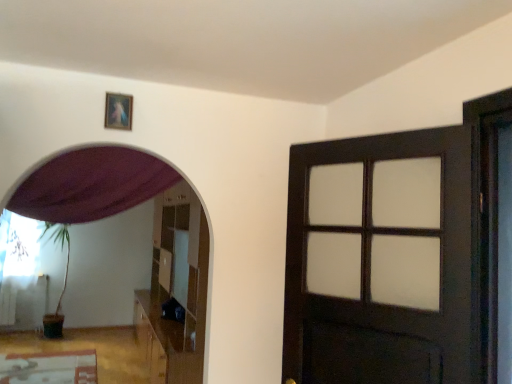
What do you see at coordinates (175, 289) in the screenshot? This screenshot has height=384, width=512. I see `glossy wooden dresser at center` at bounding box center [175, 289].

In order to face white sheer curtain at left, which is counted as the second curtain, starting from the top, should I rotate leftwards or rightwards?

Rotate your view left by about 28.781°.

Where is `wooden picture frame at upper center`? This screenshot has height=384, width=512. wooden picture frame at upper center is located at coordinates (118, 111).

Is dark wood door at right at the left side of purple fabric curtain at upper left, which is the first curtain in front-to-back order?

Incorrect, dark wood door at right is not on the left side of purple fabric curtain at upper left, which is the first curtain in front-to-back order.

From a real-world perspective, relative to purple fabric curtain at upper left, the 1th curtain positioned from the top, is dark wood door at right vertically above or below?

dark wood door at right is below purple fabric curtain at upper left, the 1th curtain positioned from the top.

Which of these two, dark wood door at right or purple fabric curtain at upper left, the 1th curtain positioned from the top, is bigger?

purple fabric curtain at upper left, the 1th curtain positioned from the top, is bigger.

Looking at this image, between glossy wooden dresser at center and white sheer curtain at left, the first curtain when ordered from left to right, which one has less height?

With less height is white sheer curtain at left, the first curtain when ordered from left to right.

The image size is (512, 384). What are the coordinates of `dresser above the white sheer curtain at left, positioned as the first curtain in back-to-front order (from the image's perspective)` in the screenshot? It's located at (175, 289).

From the image's perspective, is glossy wooden dresser at center over white sheer curtain at left, positioned as the first curtain in back-to-front order?

Yes, from the image's perspective, glossy wooden dresser at center is over white sheer curtain at left, positioned as the first curtain in back-to-front order.

Based on the photo, considering the sizes of objects glossy wooden dresser at center and white sheer curtain at left, positioned as the first curtain in back-to-front order, in the image provided, who is wider, glossy wooden dresser at center or white sheer curtain at left, positioned as the first curtain in back-to-front order,?

With larger width is glossy wooden dresser at center.

Is glossy wooden dresser at center oriented towards wooden picture frame at upper center?

No, glossy wooden dresser at center is not facing towards wooden picture frame at upper center.

Does glossy wooden dresser at center contain wooden picture frame at upper center?

Actually, wooden picture frame at upper center is outside glossy wooden dresser at center.

Is glossy wooden dresser at center taller or shorter than wooden picture frame at upper center?

glossy wooden dresser at center is taller than wooden picture frame at upper center.

From a real-world perspective, is glossy wooden dresser at center located higher than wooden picture frame at upper center?

Actually, glossy wooden dresser at center is physically below wooden picture frame at upper center in the real world.

Is white sheer curtain at left, marked as the second curtain in a front-to-back arrangement, spatially inside wooden picture frame at upper center, or outside of it?

white sheer curtain at left, marked as the second curtain in a front-to-back arrangement, lies outside wooden picture frame at upper center.

Where is `the 2nd curtain below the wooden picture frame at upper center (from the image's perspective)`? Image resolution: width=512 pixels, height=384 pixels. the 2nd curtain below the wooden picture frame at upper center (from the image's perspective) is located at coordinates (17, 245).

Is white sheer curtain at left, which is counted as the second curtain, starting from the right, placed right next to wooden picture frame at upper center?

No, white sheer curtain at left, which is counted as the second curtain, starting from the right, is not beside wooden picture frame at upper center.

What's the angular difference between dark wood door at right and wooden picture frame at upper center's facing directions?

There is a 57.9-degree angle between the facing directions of dark wood door at right and wooden picture frame at upper center.

Is dark wood door at right to the right of wooden picture frame at upper center from the viewer's perspective?

Indeed, dark wood door at right is positioned on the right side of wooden picture frame at upper center.

Could you tell me if dark wood door at right is facing wooden picture frame at upper center?

No.

Considering the sizes of dark wood door at right and wooden picture frame at upper center in the image, is dark wood door at right bigger or smaller than wooden picture frame at upper center?

dark wood door at right is bigger than wooden picture frame at upper center.

Does wooden picture frame at upper center have a greater height compared to dark wood door at right?

Incorrect, the height of wooden picture frame at upper center is not larger of that of dark wood door at right.

Considering the positions of points (124, 104) and (423, 151), is point (124, 104) farther from camera compared to point (423, 151)?

Yes, it is behind point (423, 151).

In the image, is wooden picture frame at upper center positioned in front of or behind dark wood door at right?

wooden picture frame at upper center is behind dark wood door at right.

Is wooden picture frame at upper center aimed at dark wood door at right?

No.

Does glossy wooden dresser at center have a larger size compared to dark wood door at right?

Yes.

Locate an element on the screen. dresser behind the dark wood door at right is located at coordinates (175, 289).

Looking at this image, is glossy wooden dresser at center touching dark wood door at right?

glossy wooden dresser at center and dark wood door at right are not in contact.

Considering the relative sizes of glossy wooden dresser at center and dark wood door at right in the image provided, is glossy wooden dresser at center shorter than dark wood door at right?

No, glossy wooden dresser at center is not shorter than dark wood door at right.

Identify the location of door on the right of purple fabric curtain at upper left, which ranks as the 1th curtain in right-to-left order. (380, 260).

Locate an element on the screen. The image size is (512, 384). curtain located underneath the glossy wooden dresser at center (from a real-world perspective) is located at coordinates (17, 245).

Consider the image. Estimate the real-world distances between objects in this image. Which object is further from white sheer curtain at left, positioned as the first curtain in back-to-front order, purple fabric curtain at upper left, the 1th curtain positioned from the top, or dark wood door at right?

dark wood door at right is further to white sheer curtain at left, positioned as the first curtain in back-to-front order.

From the picture: From the image, which object appears to be farther from purple fabric curtain at upper left, which is the first curtain in front-to-back order, wooden picture frame at upper center or white sheer curtain at left, which is the first curtain in bottom-to-top order?

Based on the image, white sheer curtain at left, which is the first curtain in bottom-to-top order, appears to be further to purple fabric curtain at upper left, which is the first curtain in front-to-back order.

From the image, which object appears to be nearer to purple fabric curtain at upper left, which is the 2th curtain from back to front, wooden picture frame at upper center or glossy wooden dresser at center?

wooden picture frame at upper center is closer to purple fabric curtain at upper left, which is the 2th curtain from back to front.

Looking at the image, which one is located further to glossy wooden dresser at center, dark wood door at right or purple fabric curtain at upper left, which appears as the 2th curtain when ordered from the bottom?

dark wood door at right lies further to glossy wooden dresser at center than the other object.

Which object lies further to the anchor point dark wood door at right, white sheer curtain at left, marked as the second curtain in a front-to-back arrangement, or wooden picture frame at upper center?

white sheer curtain at left, marked as the second curtain in a front-to-back arrangement.

Looking at this image, from the image, which object appears to be nearer to wooden picture frame at upper center, purple fabric curtain at upper left, which is the 2th curtain from back to front, or glossy wooden dresser at center?

purple fabric curtain at upper left, which is the 2th curtain from back to front, lies closer to wooden picture frame at upper center than the other object.

When comparing their distances from dark wood door at right, does wooden picture frame at upper center or glossy wooden dresser at center seem closer?

The object closer to dark wood door at right is wooden picture frame at upper center.

Estimate the real-world distances between objects in this image. Which object is closer to dark wood door at right, purple fabric curtain at upper left, which ranks as the 1th curtain in right-to-left order, or glossy wooden dresser at center?

The object closer to dark wood door at right is purple fabric curtain at upper left, which ranks as the 1th curtain in right-to-left order.

Find the location of a particular element. This screenshot has height=384, width=512. curtain between dark wood door at right and white sheer curtain at left, which is counted as the second curtain, starting from the top, from front to back is located at coordinates (91, 184).

This screenshot has height=384, width=512. Find the location of `dresser between purple fabric curtain at upper left, which is the 2th curtain from back to front, and white sheer curtain at left, marked as the second curtain in a front-to-back arrangement, in the front-back direction`. dresser between purple fabric curtain at upper left, which is the 2th curtain from back to front, and white sheer curtain at left, marked as the second curtain in a front-to-back arrangement, in the front-back direction is located at coordinates (175, 289).

The width and height of the screenshot is (512, 384). I want to click on dresser between dark wood door at right and white sheer curtain at left, which is counted as the second curtain, starting from the right, in the front-back direction, so click(175, 289).

I want to click on dresser located between wooden picture frame at upper center and white sheer curtain at left, positioned as the first curtain in back-to-front order, in the depth direction, so click(175, 289).